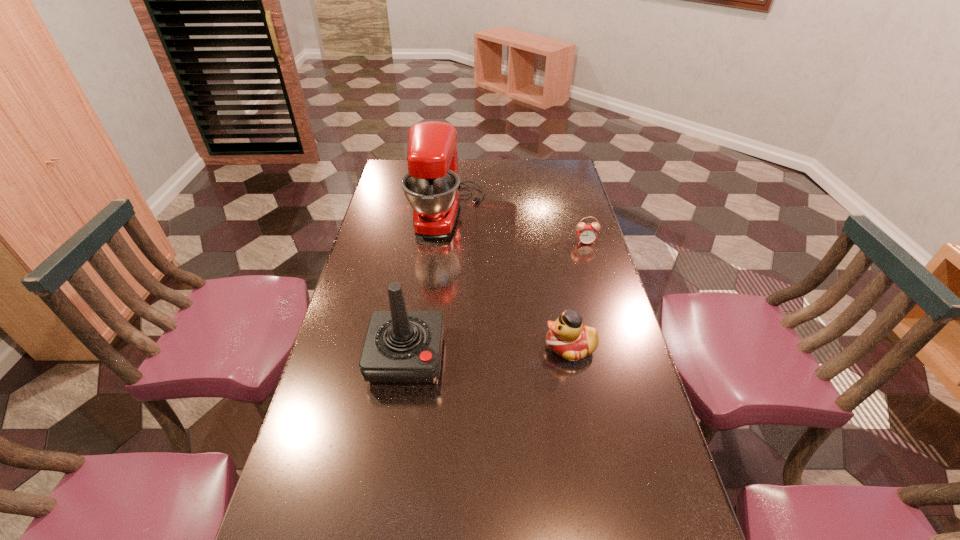
I want to click on kitchen mixer, so click(431, 186).

Where is `joystick`? The width and height of the screenshot is (960, 540). joystick is located at coordinates (401, 347).

Locate an element on the screen. This screenshot has height=540, width=960. duck is located at coordinates (568, 337).

The image size is (960, 540). Find the location of `the second shortest object`. the second shortest object is located at coordinates (568, 337).

Find the location of a particular element. Image resolution: width=960 pixels, height=540 pixels. the shortest object is located at coordinates (587, 234).

Where is `alarm clock`? This screenshot has height=540, width=960. alarm clock is located at coordinates (587, 234).

You are a GUI agent. You are given a task and a screenshot of the screen. Output one action in this format:
    pyautogui.click(x=<x>, y=<y>)
    Task: Click on the vacant space located 0.260m on the front-facing side of the tallest object
    The width and height of the screenshot is (960, 540).
    Given the screenshot: What is the action you would take?
    pyautogui.click(x=551, y=213)

Where is `vacant space located on the front-facing side of the second tallest object`? The width and height of the screenshot is (960, 540). vacant space located on the front-facing side of the second tallest object is located at coordinates (390, 465).

The width and height of the screenshot is (960, 540). In order to click on free spot located on the face of the third object from left to right in this screenshot , I will do `click(459, 347)`.

At what (x,y) coordinates should I click in order to perform the action: click on free space located on the face of the third object from left to right. Please return your answer as a coordinate pair (x, y). Looking at the image, I should click on (480, 347).